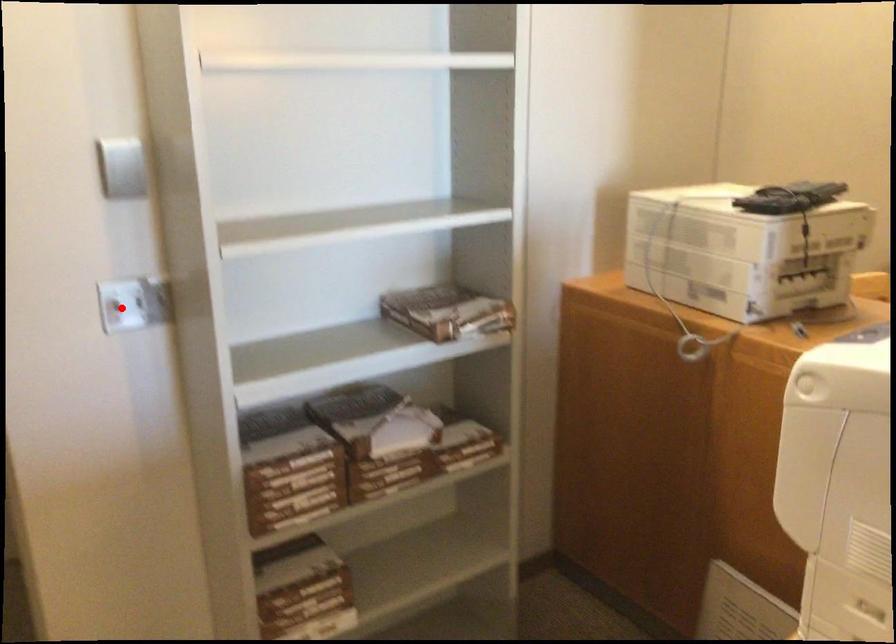
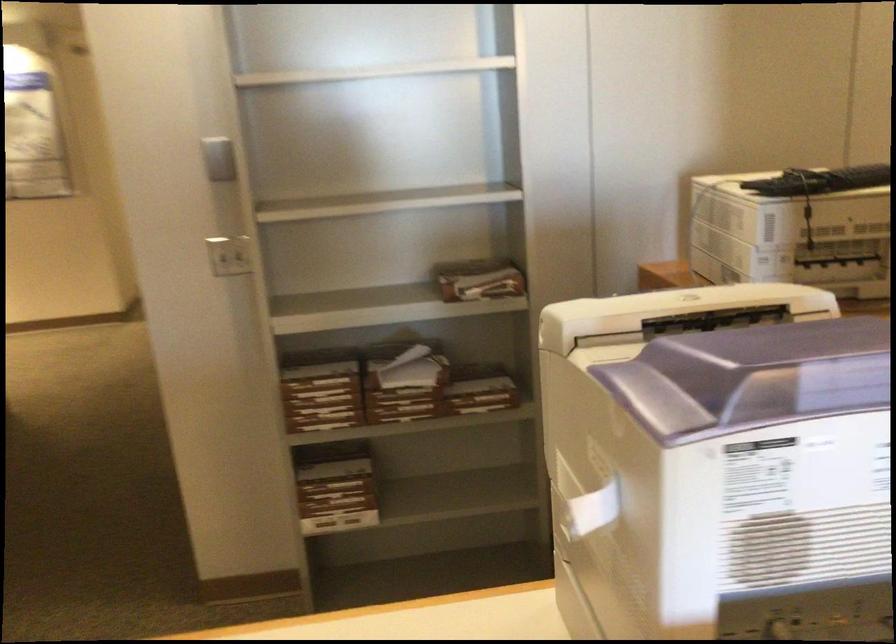
The point at the highlighted location is marked in the first image. Where is the corresponding point in the second image?

(228, 254)